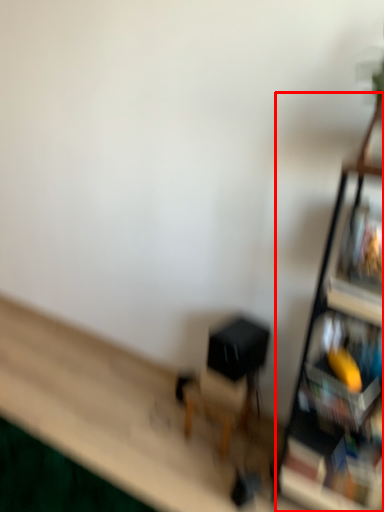
Question: Observing the image, what is the correct spatial positioning of shelf (annotated by the red box) in reference to swivel chair?

Choices:
 (A) left
 (B) right

Answer: (B)